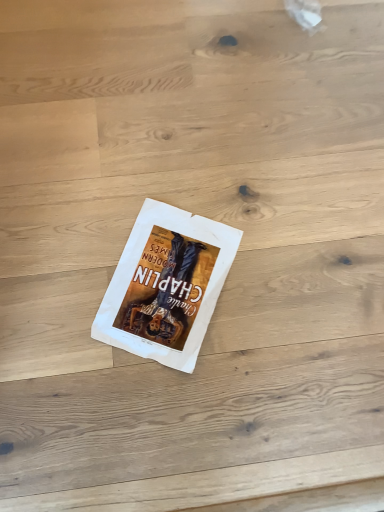
Locate an element on the screen. Image resolution: width=384 pixels, height=512 pixels. free space to the back side of white paper book at center is located at coordinates (175, 170).